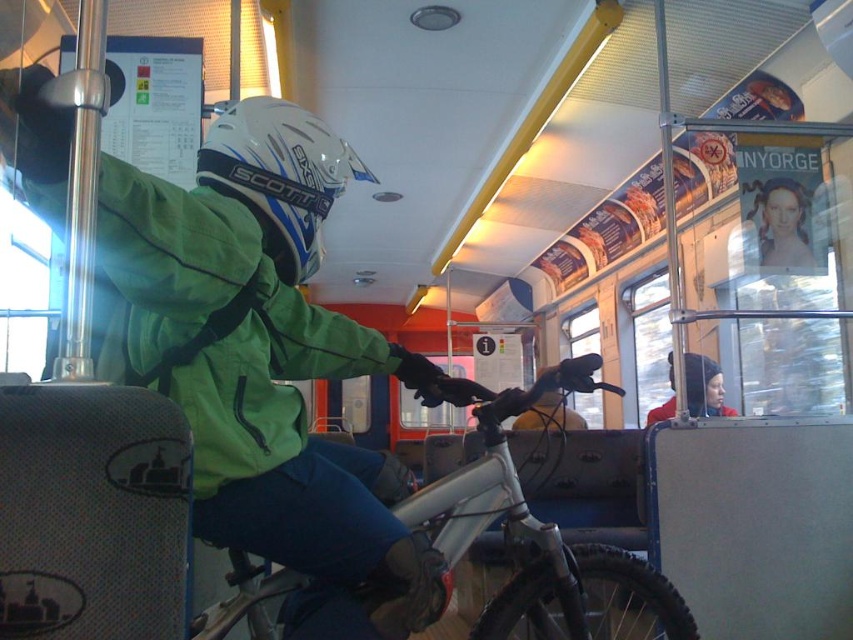
Question: Considering the relative positions of green matte jacket at upper left and white matte bicycle at center in the image provided, where is green matte jacket at upper left located with respect to white matte bicycle at center?

Choices:
 (A) above
 (B) below

Answer: (A)

Question: Is white matte helmet at upper center below smooth plastic face at upper right?

Choices:
 (A) yes
 (B) no

Answer: (A)

Question: Which object is closer to the camera taking this photo?

Choices:
 (A) white matte helmet at upper center
 (B) smooth plastic face at upper right

Answer: (A)

Question: Does white matte bicycle at center have a smaller size compared to white matte helmet at upper center?

Choices:
 (A) no
 (B) yes

Answer: (A)

Question: Among these points, which one is nearest to the camera?

Choices:
 (A) (567, 596)
 (B) (788, 179)
 (C) (213, 236)
 (D) (647, 424)

Answer: (C)

Question: Which of the following is the farthest from the observer?

Choices:
 (A) red woolen hat at upper right
 (B) smooth plastic face at upper right
 (C) white matte bicycle at center
 (D) green matte jacket at upper left

Answer: (A)